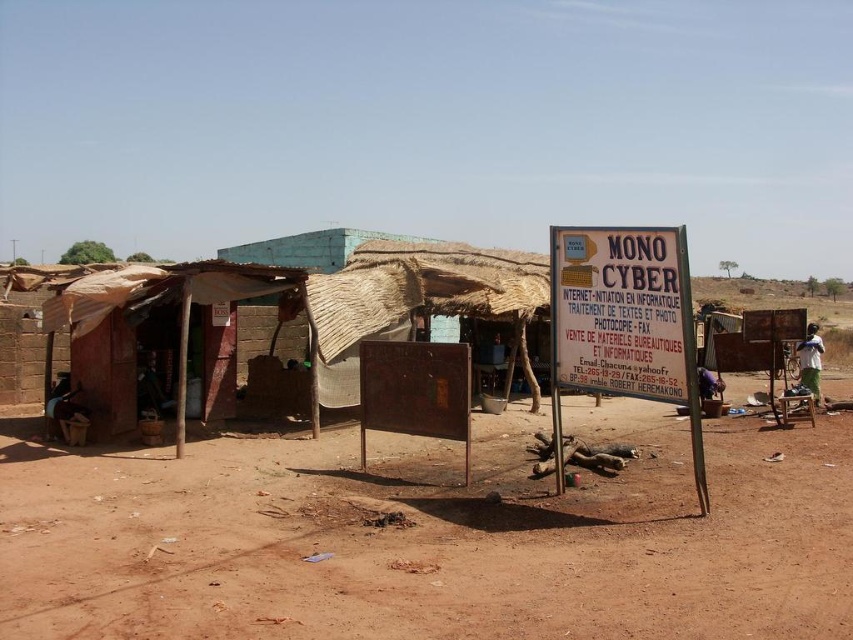
Looking at this image, what is the spatial relationship between the brown dirt field at center and the white paper sign at center in the image?

The brown dirt field at center is closer to the viewer than the white paper sign at center.